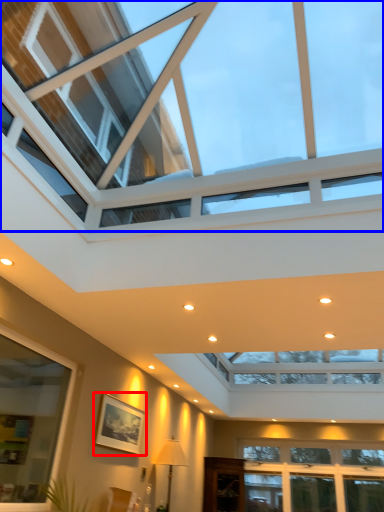
Question: Which of the following is the closest to the observer, picture frame (highlighted by a red box) or window (highlighted by a blue box)?

Choices:
 (A) picture frame
 (B) window

Answer: (B)